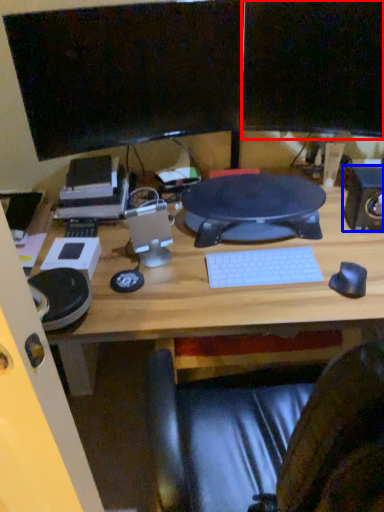
Question: Which object is further to the camera taking this photo, computer monitor (highlighted by a red box) or speaker (highlighted by a blue box)?

Choices:
 (A) computer monitor
 (B) speaker

Answer: (B)